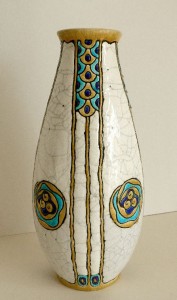
Locate an element on the screen. The width and height of the screenshot is (177, 300). right edge of vase is located at coordinates (143, 170).